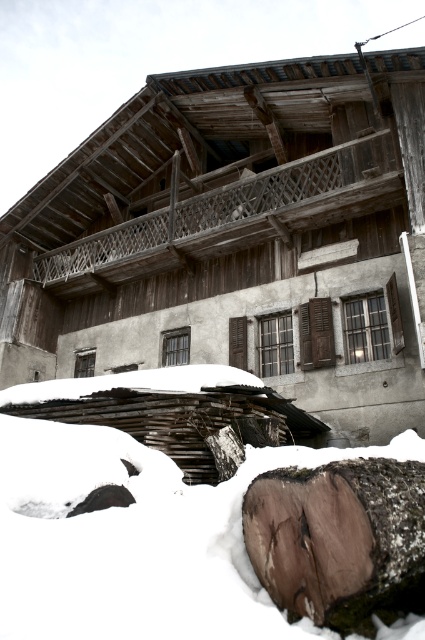
Question: Which of the following is the closest to the observer?

Choices:
 (A) white fluffy snow at lower left
 (B) wooden log cabin at center

Answer: (A)

Question: Can you confirm if white fluffy snow at lower left is smaller than brown rough wood at lower center?

Choices:
 (A) yes
 (B) no

Answer: (B)

Question: Which point is farther to the camera?

Choices:
 (A) (266, 465)
 (B) (271, 195)
 (C) (387, 481)

Answer: (B)

Question: Does wooden log cabin at center have a lesser width compared to brown rough wood at lower center?

Choices:
 (A) no
 (B) yes

Answer: (A)

Question: Considering the relative positions of white fluffy snow at lower left and brown rough wood at lower center in the image provided, where is white fluffy snow at lower left located with respect to brown rough wood at lower center?

Choices:
 (A) above
 (B) below

Answer: (B)

Question: Which object is farther from the camera taking this photo?

Choices:
 (A) brown rough wood at lower center
 (B) wooden log cabin at center

Answer: (B)